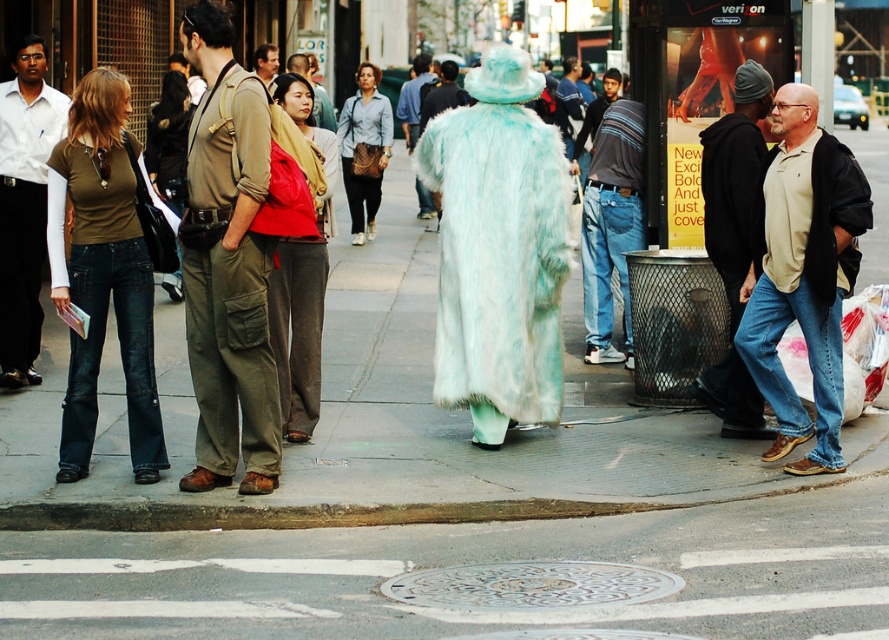
You are a photographer trying to capture a group photo of the two people wearing the light blue fur coat at center and fuzzy teal coat at center. Since they are standing close to each other, you need to know their positions relative to each other to frame the shot properly. Which one is on the right side when looking at the scene?

The light blue fur coat at center is positioned on the right side of fuzzy teal coat at center, so when looking at the scene, the light blue fur coat at center will be on the right side of the fuzzy teal coat at center.